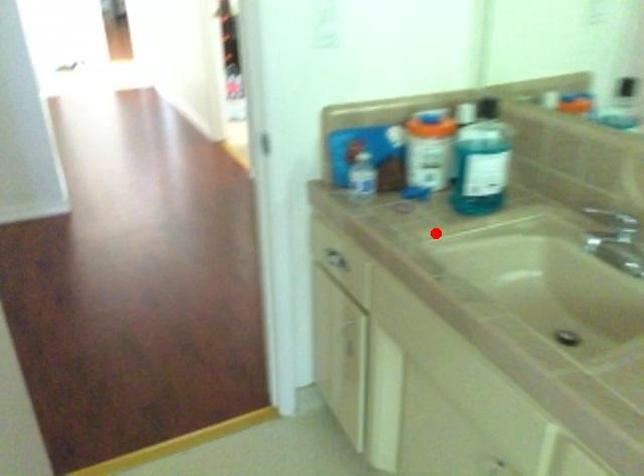
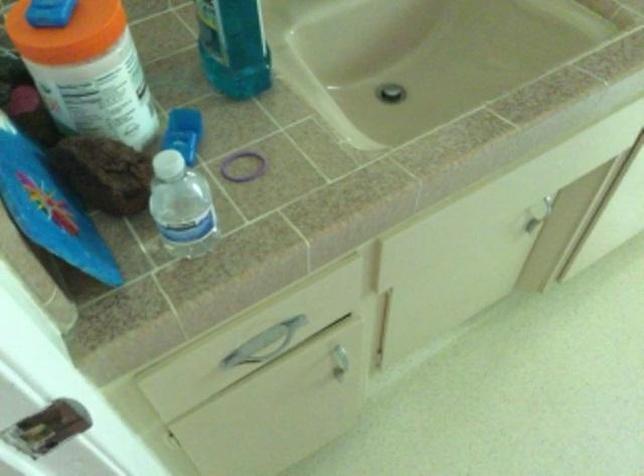
Locate, in the second image, the point that corresponds to the highlighted location in the first image.

(243, 166)